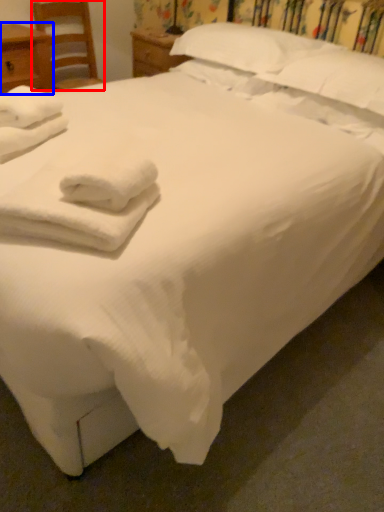
Question: Which point is closer to the camera, chair (highlighted by a red box) or nightstand (highlighted by a blue box)?

Choices:
 (A) chair
 (B) nightstand

Answer: (B)